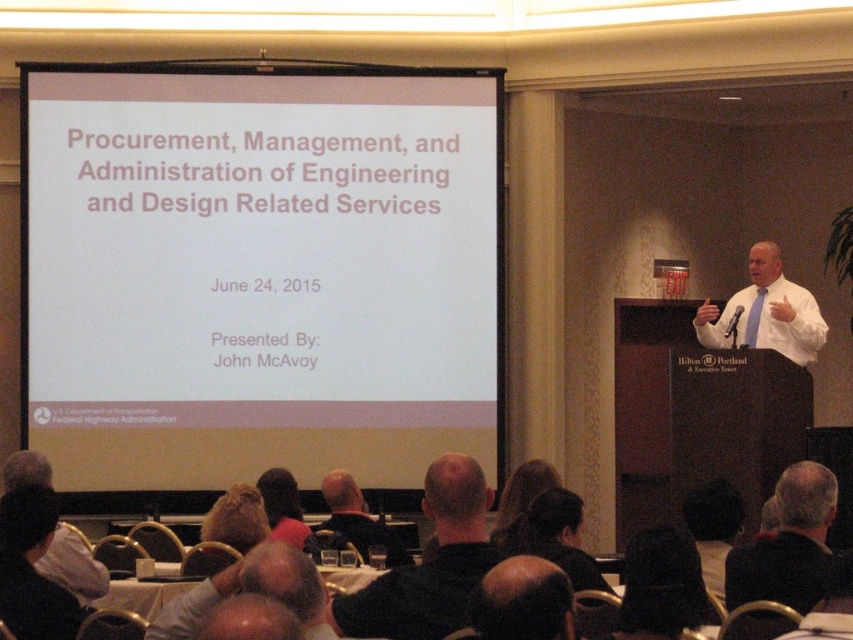
Question: Can you confirm if black suit at lower right is positioned to the right of light brown hair at center?

Choices:
 (A) yes
 (B) no

Answer: (A)

Question: Can you confirm if white shirt at center is positioned above light brown hair at center?

Choices:
 (A) yes
 (B) no

Answer: (A)

Question: Which object is closer to the camera taking this photo?

Choices:
 (A) black hair at upper center
 (B) light brown hair at center

Answer: (B)

Question: Which object is positioned farthest from the black hair at upper center?

Choices:
 (A) white matte projector screen at upper center
 (B) black shirt at lower left
 (C) light brown hair at center
 (D) white shirt at center

Answer: (A)

Question: Does black suit at lower right have a greater width compared to bald head at center?

Choices:
 (A) no
 (B) yes

Answer: (B)

Question: Which point appears closest to the camera in this image?

Choices:
 (A) (805, 568)
 (B) (796, 324)
 (C) (473, 458)
 (D) (339, 531)

Answer: (A)